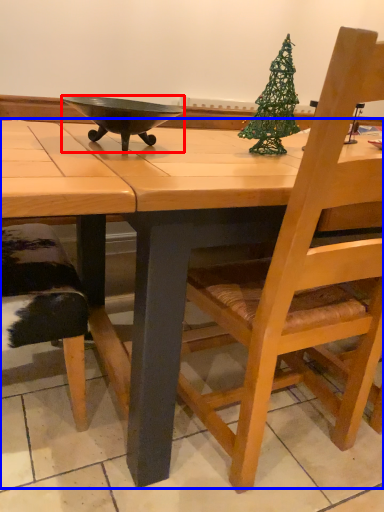
Question: Which object is further to the camera taking this photo, bowl (highlighted by a red box) or desk (highlighted by a blue box)?

Choices:
 (A) bowl
 (B) desk

Answer: (A)